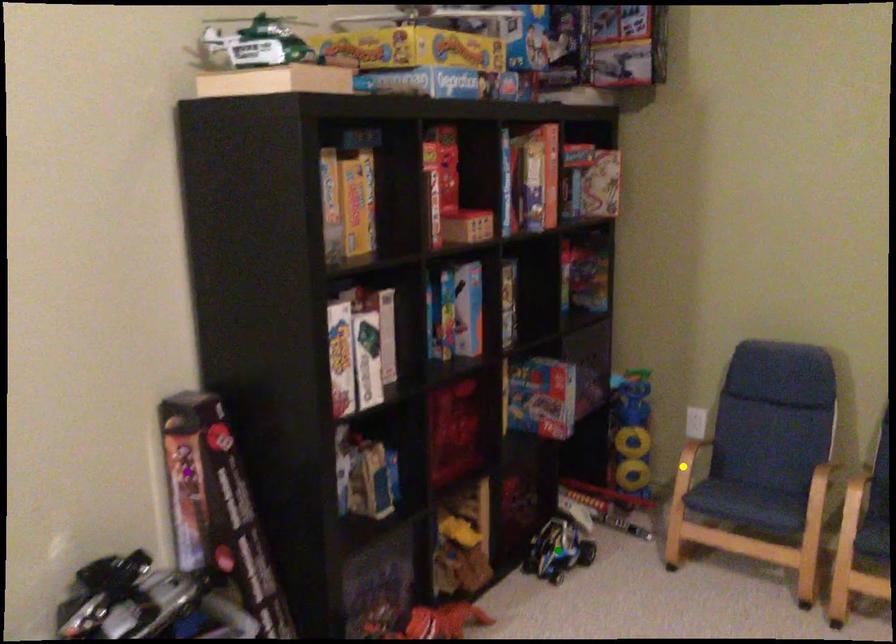
Order these from nearest to farthest:
green point
yellow point
purple point

purple point
yellow point
green point